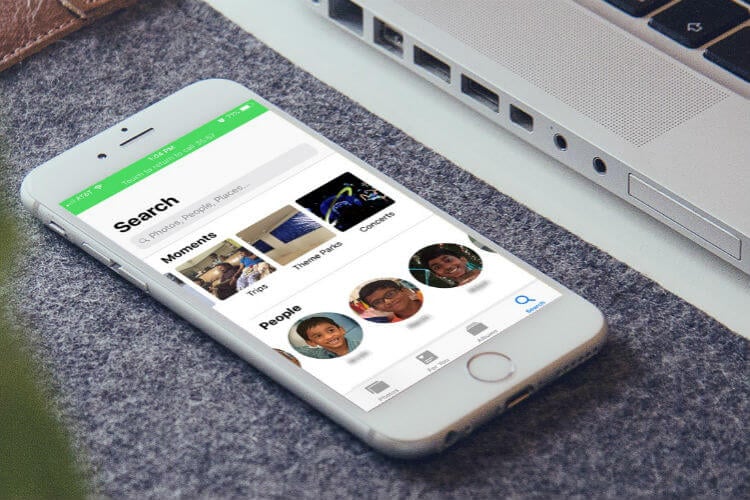
Where is `number of buttons or switches you can press or flip in the image`? The image size is (750, 500). number of buttons or switches you can press or flip in the image is located at coordinates (58, 233), (94, 256), (136, 279), (492, 375), (670, 221), (726, 56), (678, 27), (631, 14).